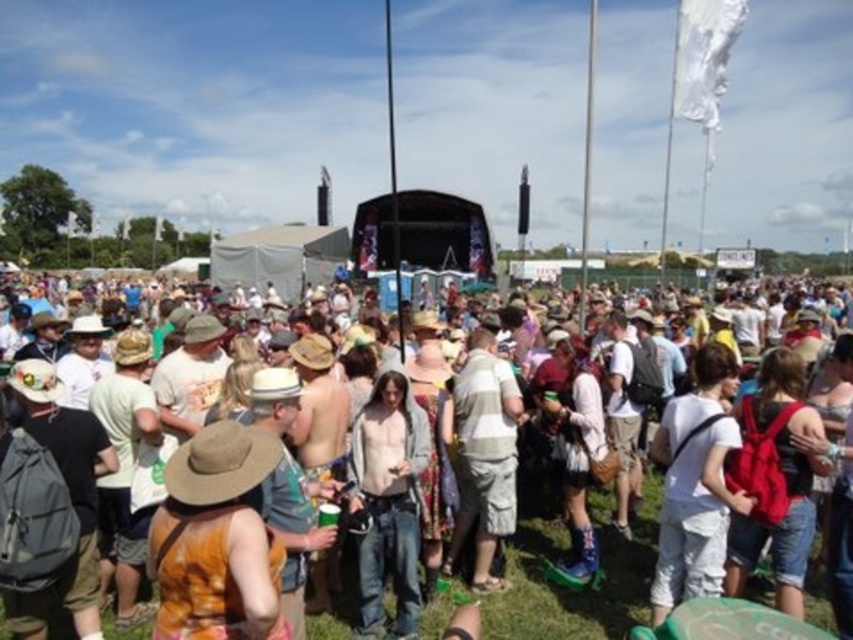
Who is positioned more to the left, matte white tent at center or brown straw cowboy hat at center?

brown straw cowboy hat at center

Is point (326, 632) behind point (202, 499)?

Yes, it is.

Between point (648, 486) and point (252, 458), which one is positioned behind?

Point (648, 486)

The image size is (853, 640). In order to click on matte white tent at center in this screenshot , I will do `click(566, 550)`.